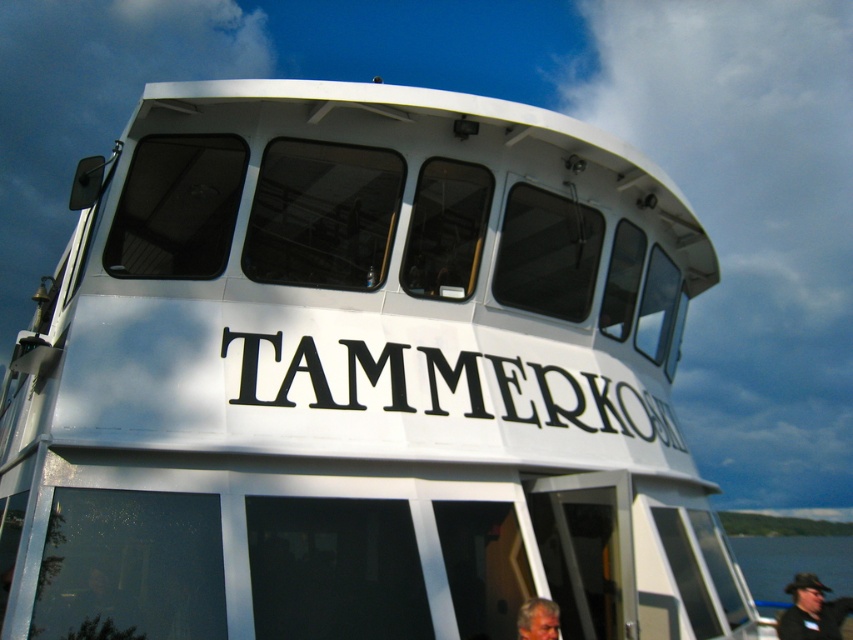
You are standing on the deck of the boat named TAMMERKOSKI. You want to take a photo of the blue water at lower right. Where should you point your camera?

You should point your camera to the lower right at point coordinates approximately (x=793, y=563) to capture the blue water at lower right.